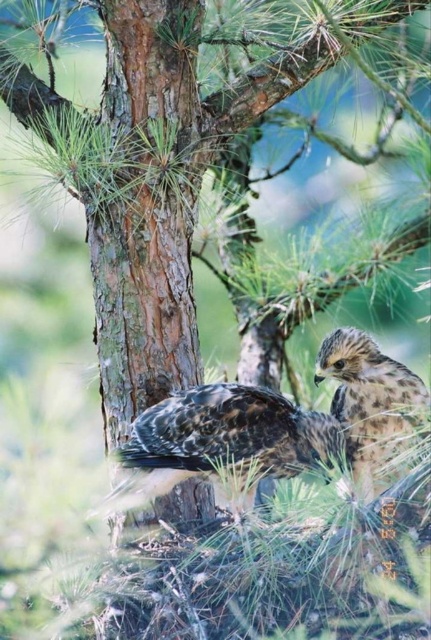
Can you confirm if brown speckled feathers at center is shorter than speckled brown eagle at right?

No, brown speckled feathers at center is not shorter than speckled brown eagle at right.

Which of these two, brown speckled feathers at center or speckled brown eagle at right, stands shorter?

speckled brown eagle at right

The height and width of the screenshot is (640, 431). Find the location of `brown speckled feathers at center`. brown speckled feathers at center is located at coordinates (224, 442).

The image size is (431, 640). Identify the location of brown speckled feathers at center. (224, 442).